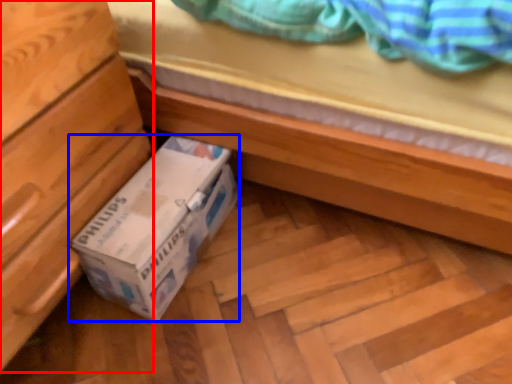
Question: Among these objects, which one is nearest to the camera, chest of drawers (highlighted by a red box) or box (highlighted by a blue box)?

Choices:
 (A) chest of drawers
 (B) box

Answer: (A)